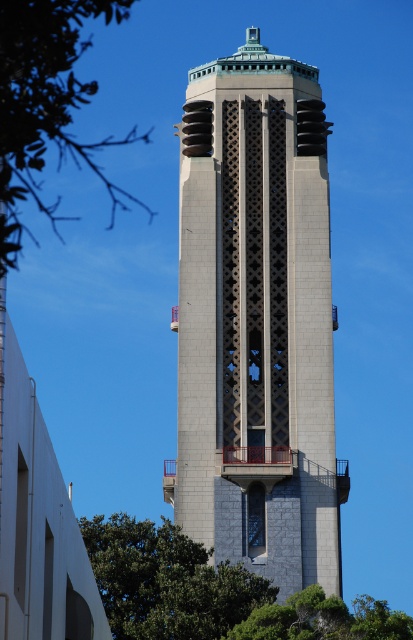
Does gray stone bell tower at center have a lesser height compared to green leafy tree at lower center?

No, gray stone bell tower at center is not shorter than green leafy tree at lower center.

Measure the distance between point (282,541) and camera.

Point (282,541) and camera are 106.56 meters apart.

Where is `gray stone bell tower at center`? The image size is (413, 640). gray stone bell tower at center is located at coordinates (256, 321).

Is green leafy tree at upper left positioned behind green leafy tree at lower center?

No, green leafy tree at upper left is in front of green leafy tree at lower center.

Where is `green leafy tree at upper left`? This screenshot has width=413, height=640. green leafy tree at upper left is located at coordinates (45, 106).

Find the location of a particular element. This screenshot has height=640, width=413. green leafy tree at upper left is located at coordinates (45, 106).

Can you confirm if gray stone bell tower at center is positioned below green leafy tree at lower right?

Actually, gray stone bell tower at center is above green leafy tree at lower right.

Who is more forward, (287, 99) or (348, 614)?

Point (348, 614)

The height and width of the screenshot is (640, 413). Find the location of `gray stone bell tower at center`. gray stone bell tower at center is located at coordinates (256, 321).